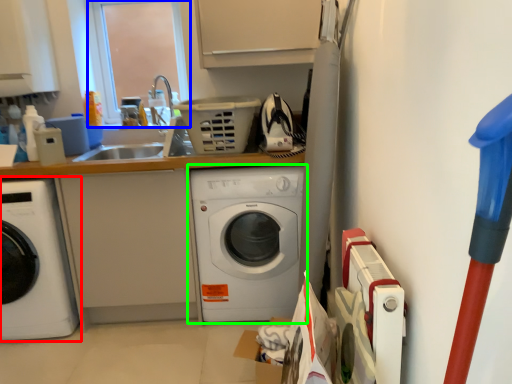
Question: Which is nearer to the washing machine (highlighted by a red box)? window screen (highlighted by a blue box) or washing machine (highlighted by a green box).

Choices:
 (A) window screen
 (B) washing machine

Answer: (B)